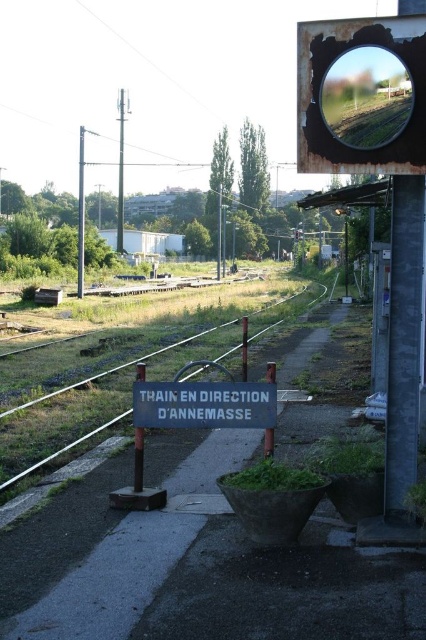
Based on the scene described, what object is located at the coordinates point (62, 451)?

The metal train track at left is located at point (62, 451).

You are standing on the platform and want to take a photo of the blue painted metal pole at center without including the metal train track at left in the frame. Is it possible to position yourself in such a way that the pole is visible but the track is not?

The blue painted metal pole at center is behind the metal train track at left, so if you position yourself so that the pole is behind the track, you can take the photo without the track appearing. However, since the pole is behind the track, you might need to angle your camera to capture the pole while avoiding the track in the foreground.